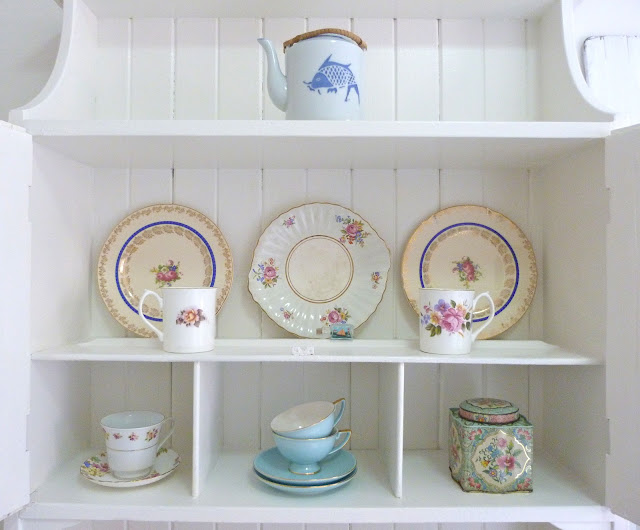
Image resolution: width=640 pixels, height=530 pixels. What are the coordinates of `baby blue plates` in the screenshot? It's located at (278, 472).